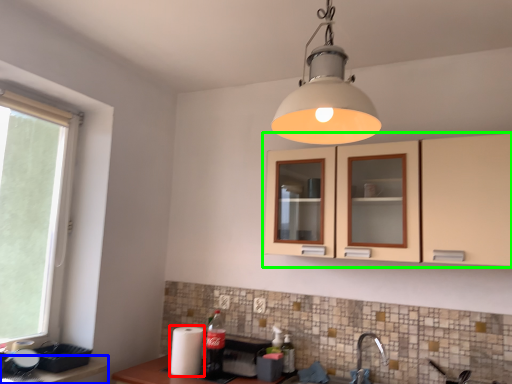
Question: Which is nearer to the appliance (highlighted by a red box)? counter top (highlighted by a blue box) or cabinetry (highlighted by a green box).

Choices:
 (A) counter top
 (B) cabinetry

Answer: (A)